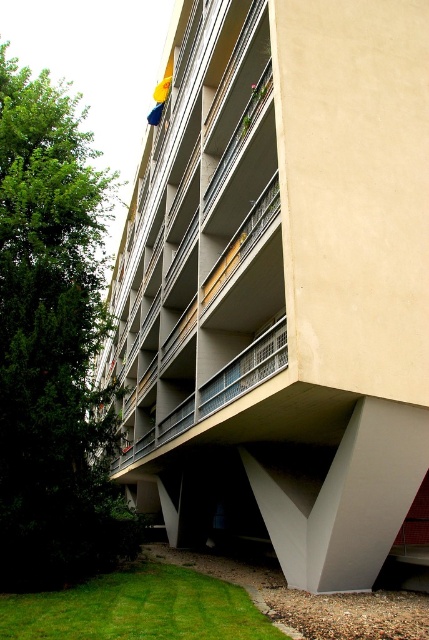
You are standing in front of the modern residential building and notice the green leafy tree at left and the green grass at lower left. Which of these two is positioned more to the left side?

The green leafy tree at left is positioned more to the left than the green grass at lower left.